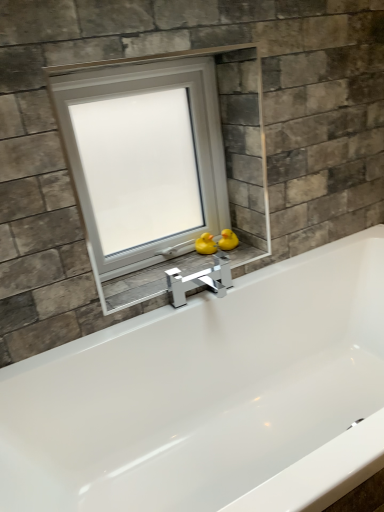
The image size is (384, 512). What are the coordinates of `free space in front of yellow rubber duck at center, acting as the 1th duck starting from the left` in the screenshot? It's located at (203, 267).